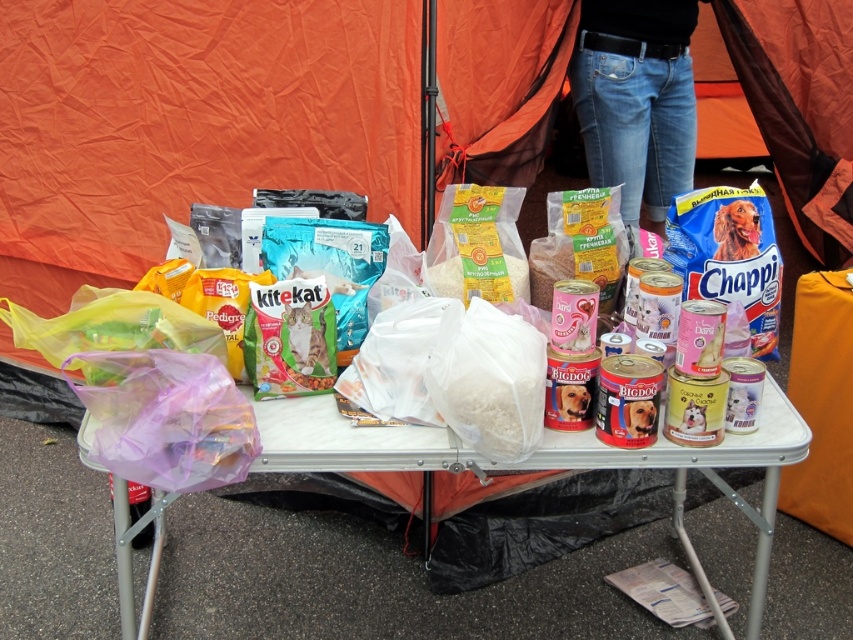
Can you confirm if translucent plastic bag at lower left is positioned above jeans at center?

Incorrect, translucent plastic bag at lower left is not positioned above jeans at center.

Does translucent plastic bag at lower left come behind jeans at center?

No, it is not.

The width and height of the screenshot is (853, 640). Identify the location of translucent plastic bag at lower left. tap(701, 470).